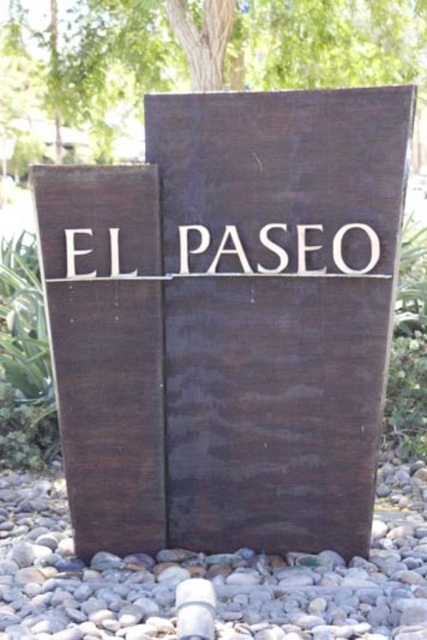
Question: Is dark brown wood sign at center to the left of gray gravel at lower center from the viewer's perspective?

Choices:
 (A) yes
 (B) no

Answer: (B)

Question: Does dark brown wood sign at center appear on the right side of gray gravel at lower center?

Choices:
 (A) yes
 (B) no

Answer: (A)

Question: Does dark brown wood sign at center appear on the right side of gray gravel at lower center?

Choices:
 (A) yes
 (B) no

Answer: (A)

Question: Which object is closer to the camera taking this photo?

Choices:
 (A) dark brown wood sign at center
 (B) gray gravel at lower center

Answer: (B)